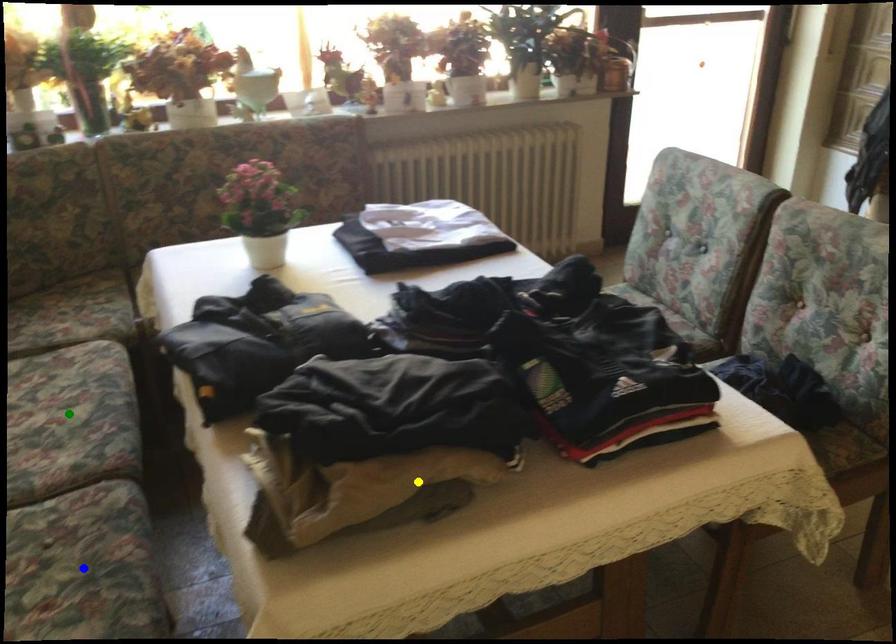
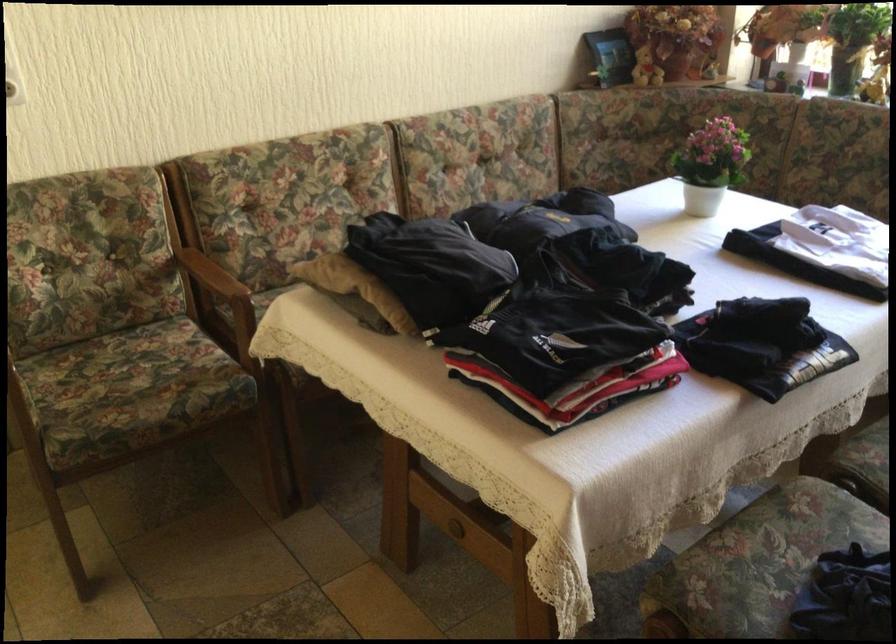
I am providing you with two images of the same scene from different viewpoints. Three points are marked in image1. Which point corresponds to a part or object that is occluded in image2?In image1, three points are marked. Which of them correspond to a part or object that is occluded in image2?Among the three points shown in image1, which one corresponds to a part or object that is no longer visible due to occlusion in image2?

green point, blue point